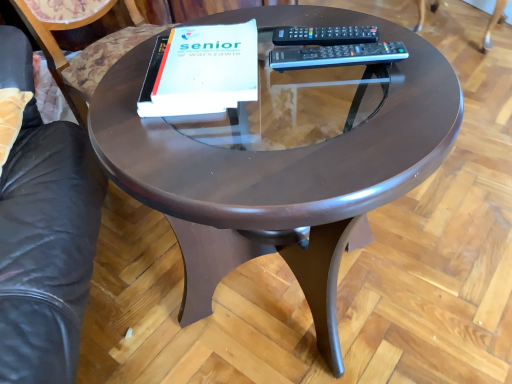
Find the location of a particular element. vacant area that is in front of white matte paper at center is located at coordinates (205, 162).